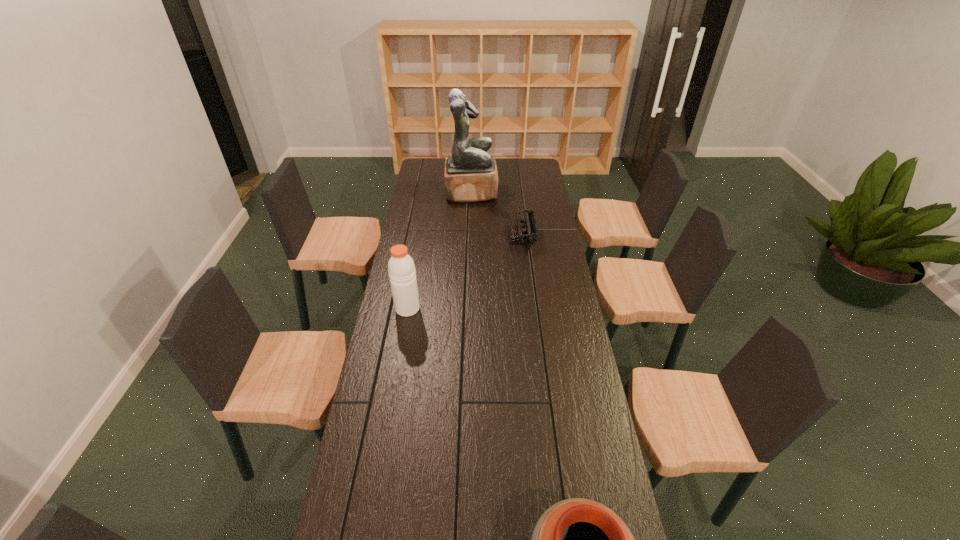
At what (x,y) coordinates should I click in order to perform the action: click on the third object from right to left. Please return your answer as a coordinate pair (x, y). This screenshot has height=540, width=960. Looking at the image, I should click on (470, 175).

At what (x,y) coordinates should I click in order to perform the action: click on the tallest object. Please return your answer as a coordinate pair (x, y). The height and width of the screenshot is (540, 960). Looking at the image, I should click on (470, 175).

This screenshot has width=960, height=540. In order to click on the third farthest object in this screenshot , I will do `click(401, 267)`.

Identify the location of shaker. The image size is (960, 540). (401, 267).

Locate an element on the screen. Image resolution: width=960 pixels, height=540 pixels. typewriter is located at coordinates (525, 234).

Find the location of a particular element. the shortest object is located at coordinates (x=525, y=234).

In order to click on free space located in a relaxed pose on the sculpture in this screenshot , I will do `click(542, 192)`.

The image size is (960, 540). Identify the location of free location located on the back of the third farthest object. (417, 255).

Locate an element on the screen. The image size is (960, 540). blank space located on the typing side of the second farthest object is located at coordinates (456, 237).

What are the coordinates of `free space located 0.060m on the typing side of the second farthest object` in the screenshot? It's located at (496, 237).